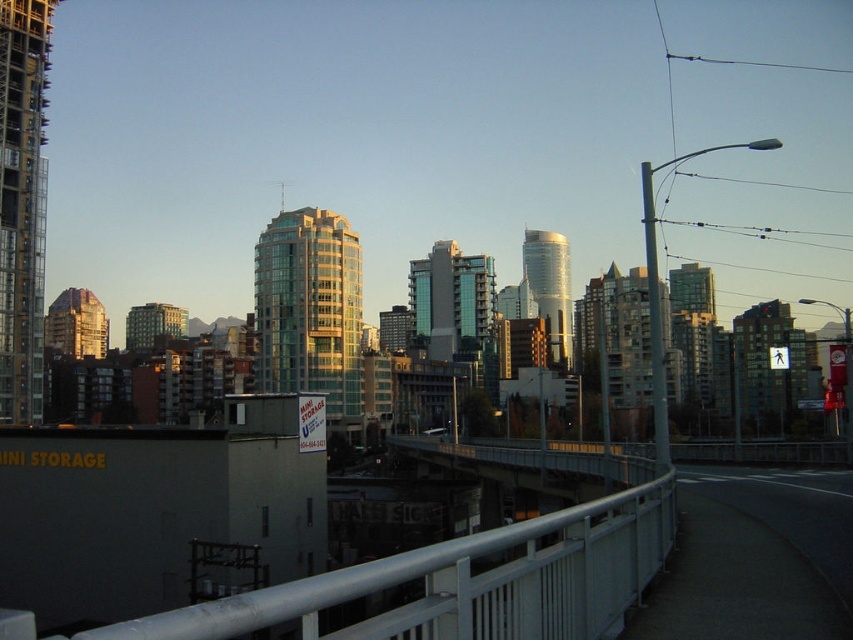
Question: Can you confirm if white metal railing at lower center is positioned to the right of metallic gray bridge at center?

Choices:
 (A) no
 (B) yes

Answer: (A)

Question: Which point is farther to the camera?

Choices:
 (A) (457, 573)
 (B) (555, 467)

Answer: (B)

Question: Is white metal railing at lower center below metallic gray bridge at center?

Choices:
 (A) yes
 (B) no

Answer: (B)

Question: Which point is closer to the camera?

Choices:
 (A) (616, 529)
 (B) (409, 445)

Answer: (A)

Question: Does white metal railing at lower center appear on the left side of metallic gray bridge at center?

Choices:
 (A) no
 (B) yes

Answer: (B)

Question: Which of the following is the closest to the observer?

Choices:
 (A) (498, 620)
 (B) (492, 461)

Answer: (A)